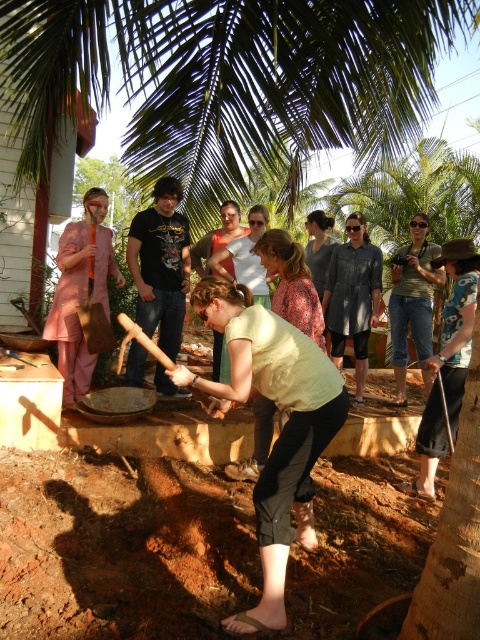
You are standing in the tropical outdoor scene and want to hand the orange wooden shovel at center to the person wearing the green fabric shirt at center. Which direction should you move the shovel to reach them?

The green fabric shirt at center is closer to the viewer than the orange wooden shovel at center, so you should move the shovel forward towards the viewer to reach the person wearing the green fabric shirt at center.

You are a visitor at this tropical gathering and need to choose between the matte pink fabric at left and the orange wooden shovel at center for a task that requires a wider object. Which one should you pick?

The matte pink fabric at left is wider than the orange wooden shovel at center, so you should pick the matte pink fabric at left for the task.